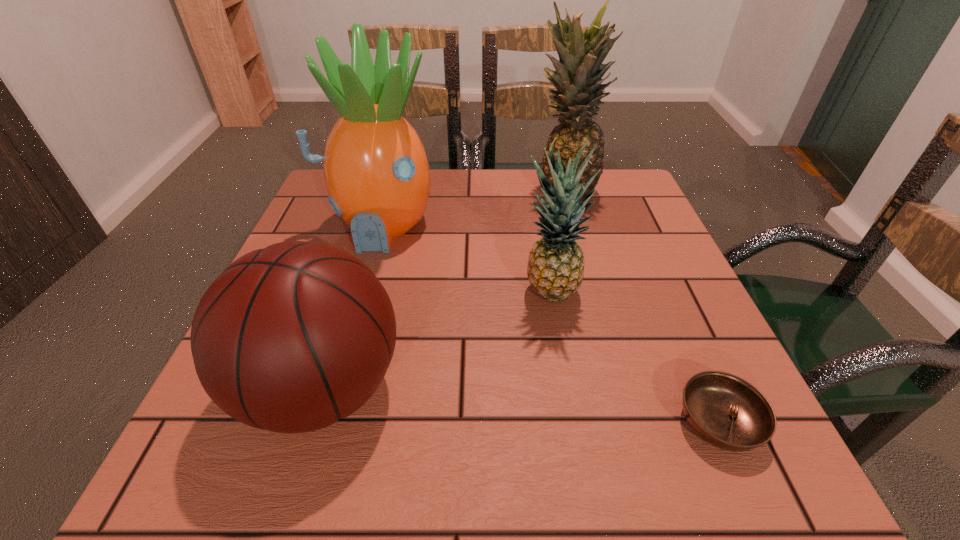
I want to click on free space at the near edge of the desktop, so click(x=324, y=464).

The width and height of the screenshot is (960, 540). What are the coordinates of `vacant space at the left edge of the desktop` in the screenshot? It's located at (205, 416).

I want to click on vacant space at the right edge of the desktop, so click(x=596, y=226).

This screenshot has width=960, height=540. I want to click on vacant space at the near left corner, so click(177, 485).

The image size is (960, 540). In the image, there is a desktop. Find the location of `free space at the far right corner`. free space at the far right corner is located at coordinates click(x=645, y=196).

Identify the location of free area in between the shortest object and the third farthest object. (635, 357).

The width and height of the screenshot is (960, 540). What are the coordinates of `free space between the leftmost pineapple and the third tallest object` in the screenshot? It's located at (465, 260).

The width and height of the screenshot is (960, 540). Find the location of `vacant area between the basketball and the third tallest object`. vacant area between the basketball and the third tallest object is located at coordinates (437, 341).

At what (x,y) coordinates should I click in order to perform the action: click on empty location between the third farthest object and the shortest object. Please return your answer as a coordinate pair (x, y). The image size is (960, 540). Looking at the image, I should click on (635, 357).

The width and height of the screenshot is (960, 540). I want to click on blank region between the third nearest object and the fourth tallest object, so click(x=437, y=341).